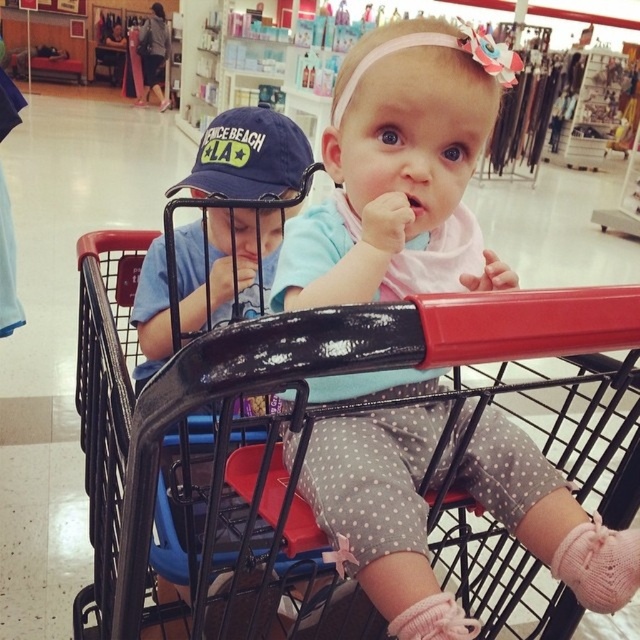
Consider the image. Does polka dot leggings at center have a smaller size compared to black plastic shopping cart at center?

Correct, polka dot leggings at center occupies less space than black plastic shopping cart at center.

Who is more forward, (429,179) or (154,392)?

Positioned in front is point (154,392).

Locate an element on the screen. The height and width of the screenshot is (640, 640). polka dot leggings at center is located at coordinates (401, 172).

From the picture: Who is more forward, (157, 432) or (259, 218)?

Point (157, 432)

Is black plastic shopping cart at center to the right of blue cotton cap at upper left from the viewer's perspective?

Yes, black plastic shopping cart at center is to the right of blue cotton cap at upper left.

The image size is (640, 640). Describe the element at coordinates (262, 388) in the screenshot. I see `black plastic shopping cart at center` at that location.

Where is `black plastic shopping cart at center`? black plastic shopping cart at center is located at coordinates (262, 388).

Between polka dot leggings at center and blue cotton cap at upper left, which one is positioned higher?

blue cotton cap at upper left is above.

Is polka dot leggings at center below blue cotton cap at upper left?

Indeed, polka dot leggings at center is positioned under blue cotton cap at upper left.

Does point (426, 36) come closer to viewer compared to point (180, 252)?

Yes.

Where is `polka dot leggings at center`? polka dot leggings at center is located at coordinates (401, 172).